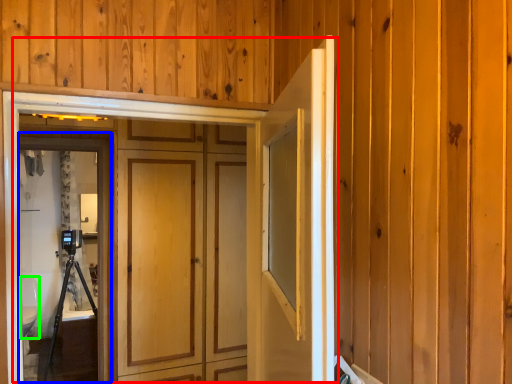
Question: Estimate the real-world distances between objects in this image. Which object is farther from door (highlighted by a red box), screen door (highlighted by a blue box) or toilet bowl (highlighted by a green box)?

Choices:
 (A) screen door
 (B) toilet bowl

Answer: (B)